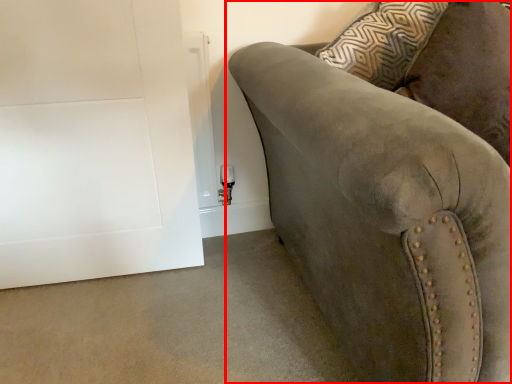
Question: From the image's perspective, what is the correct spatial positioning of studio couch (annotated by the red box) in reference to door?

Choices:
 (A) below
 (B) above

Answer: (A)